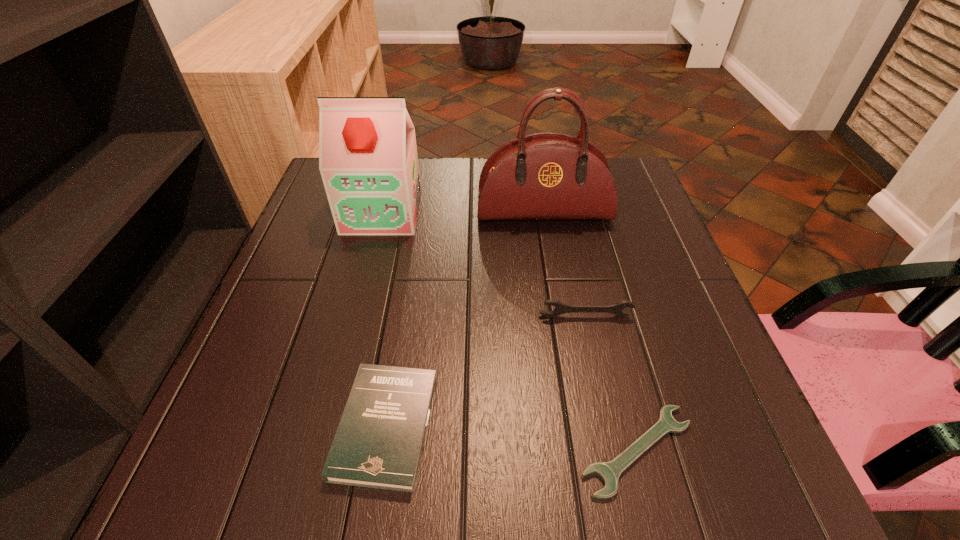
You are a GUI agent. You are given a task and a screenshot of the screen. Output one action in this format:
    pyautogui.click(x=<x>, y=<y>)
    Task: Click on the vacant area in the image that satisfies the following two spatial constraints: 1. on the front-facing side of the handbag; 2. on the left side of the nearer wrench
    The height and width of the screenshot is (540, 960).
    Given the screenshot: What is the action you would take?
    pyautogui.click(x=584, y=450)

Locate an element on the screen. free space that satisfies the following two spatial constraints: 1. with the cap open on the book; 2. on the left side of the soya milk is located at coordinates (326, 426).

Where is `free space that satisfies the following two spatial constraints: 1. on the front side of the shorter wrench; 2. on the right side of the book`? Image resolution: width=960 pixels, height=540 pixels. free space that satisfies the following two spatial constraints: 1. on the front side of the shorter wrench; 2. on the right side of the book is located at coordinates (382, 450).